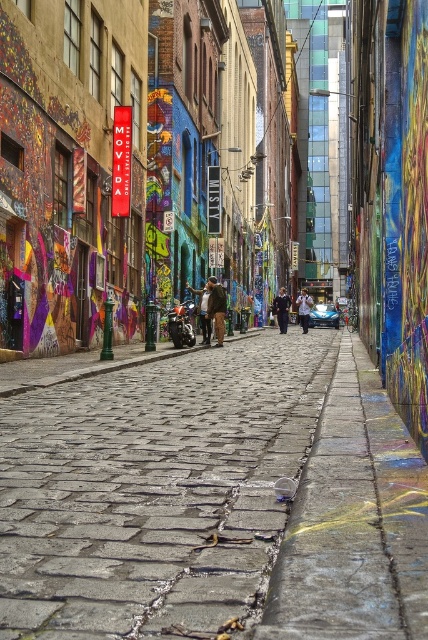
Question: Can you confirm if gray cobblestone pavement at center is wider than shiny chrome motorcycle at center?

Choices:
 (A) yes
 (B) no

Answer: (A)

Question: Which point is closer to the camera?

Choices:
 (A) dark brown leather jacket at center
 (B) gray cobblestone pavement at center
 (C) shiny chrome motorcycle at center

Answer: (B)

Question: Which object appears farthest from the camera in this image?

Choices:
 (A) dark brown leather jacket at center
 (B) dark blue jeans at center
 (C) gray cobblestone pavement at center

Answer: (B)

Question: Which object is closer to the camera taking this photo?

Choices:
 (A) brown leather jacket at center
 (B) shiny chrome motorcycle at center
 (C) gray cobblestone pavement at center
 (D) dark blue jacket at center

Answer: (C)

Question: Can you confirm if gray cobblestone pavement at center is positioned below dark blue jeans at center?

Choices:
 (A) yes
 (B) no

Answer: (A)

Question: Does brown leather jacket at center have a smaller size compared to dark brown leather jacket at center?

Choices:
 (A) yes
 (B) no

Answer: (A)